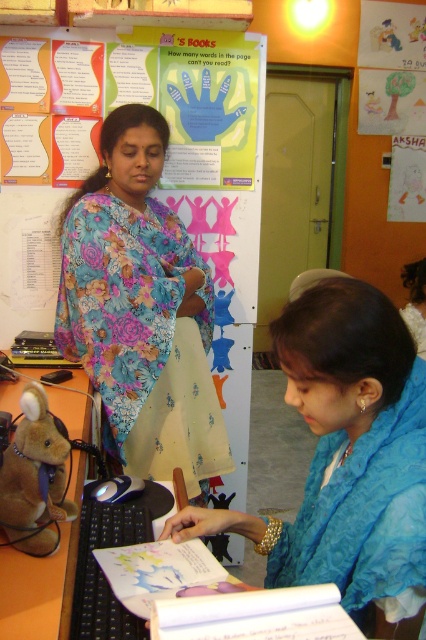
Image resolution: width=426 pixels, height=640 pixels. I want to click on blue fabric scarf at lower right, so click(x=345, y=454).

Which of these two, floral fabric saree at center or brown plush toy at lower left, stands taller?

Standing taller between the two is floral fabric saree at center.

Can you confirm if floral fabric saree at center is wider than brown plush toy at lower left?

Yes.

What do you see at coordinates (141, 308) in the screenshot? I see `floral fabric saree at center` at bounding box center [141, 308].

What are the coordinates of `floral fabric saree at center` in the screenshot? It's located at (141, 308).

From the picture: Is blue fabric scarf at lower right shorter than floral fabric saree at center?

Correct, blue fabric scarf at lower right is not as tall as floral fabric saree at center.

Between blue fabric scarf at lower right and floral fabric saree at center, which one appears on the left side from the viewer's perspective?

Positioned to the left is floral fabric saree at center.

Is point (294, 314) farther from viewer compared to point (207, 474)?

No, it is not.

At what (x,y) coordinates should I click in order to perform the action: click on blue fabric scarf at lower right. Please return your answer as a coordinate pair (x, y). This screenshot has height=640, width=426. Looking at the image, I should click on (345, 454).